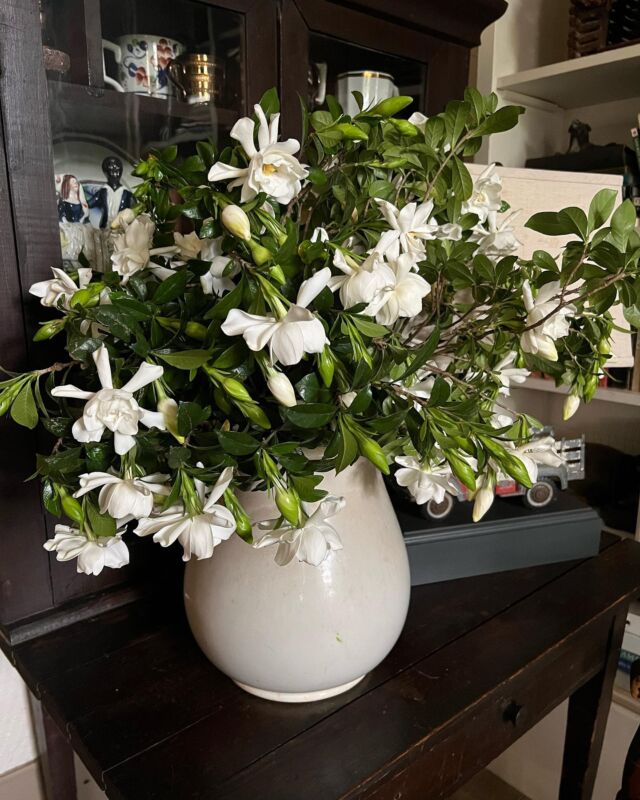
I want to click on white mug with gold, so click(356, 92).